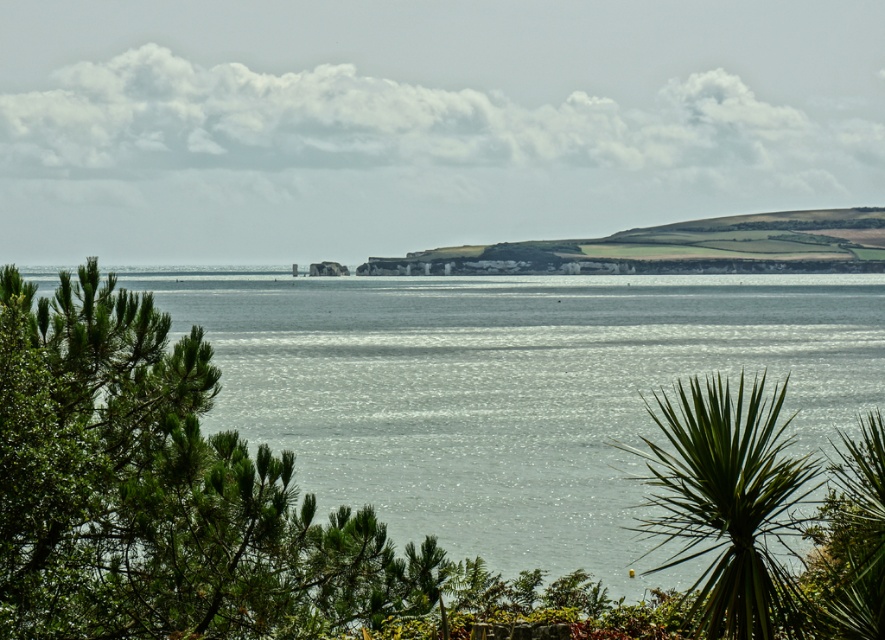
Does green leafy tree at center-left appear on the right side of green leafy palm tree at lower right?

No, green leafy tree at center-left is not to the right of green leafy palm tree at lower right.

You are a GUI agent. You are given a task and a screenshot of the screen. Output one action in this format:
    pyautogui.click(x=<x>, y=<y>)
    Task: Click on the green leafy tree at center-left
    The height and width of the screenshot is (640, 885).
    Given the screenshot: What is the action you would take?
    pyautogui.click(x=160, y=492)

Is point (235, 513) positioned after point (708, 620)?

Yes, point (235, 513) is behind point (708, 620).

Where is `green leafy tree at center-left`? The height and width of the screenshot is (640, 885). green leafy tree at center-left is located at coordinates (160, 492).

Is clear water at center taller than green grassy hill at center?

Incorrect, clear water at center's height is not larger of green grassy hill at center's.

The image size is (885, 640). Identify the location of clear water at center. (509, 388).

Who is positioned more to the left, clear water at center or green leafy tree at center-left?

Positioned to the left is green leafy tree at center-left.

Can you confirm if clear water at center is taller than green leafy tree at center-left?

Yes, clear water at center is taller than green leafy tree at center-left.

Does point (559, 376) come closer to viewer compared to point (241, 449)?

No.

You are a GUI agent. You are given a task and a screenshot of the screen. Output one action in this format:
    pyautogui.click(x=<x>, y=<y>)
    Task: Click on the clear water at center
    The image size is (885, 640).
    Given the screenshot: What is the action you would take?
    pyautogui.click(x=509, y=388)